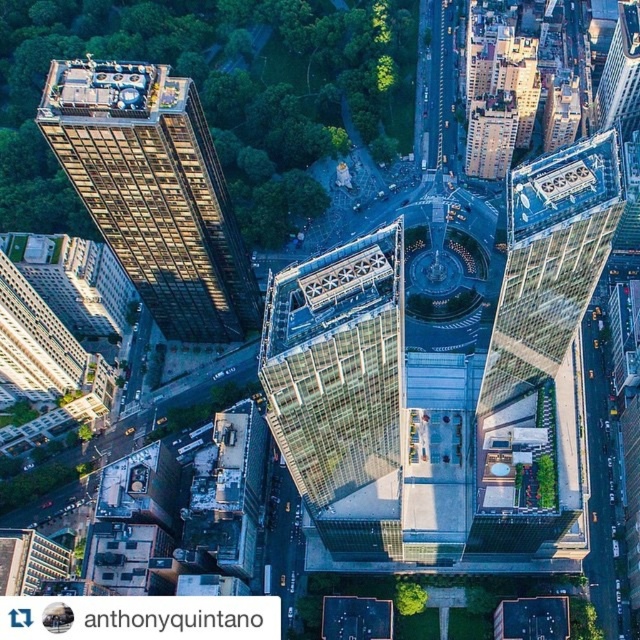
Can you confirm if dark brown glass skyscraper at left is positioned to the left of transparent glass skyscraper at center?

Yes, dark brown glass skyscraper at left is to the left of transparent glass skyscraper at center.

Between dark brown glass skyscraper at left and transparent glass skyscraper at center, which one has more height?

Standing taller between the two is transparent glass skyscraper at center.

Which is behind, point (116, 216) or point (285, 433)?

The point (116, 216) is more distant.

Locate an element on the screen. The width and height of the screenshot is (640, 640). dark brown glass skyscraper at left is located at coordinates coord(154,192).